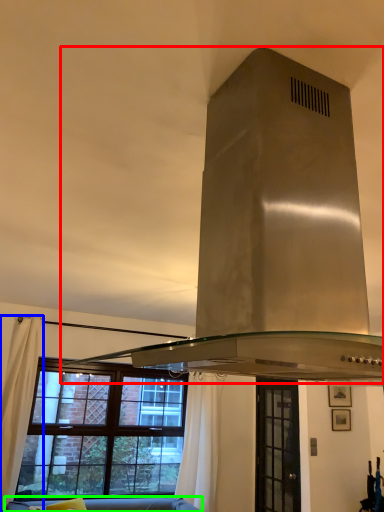
Question: Considering the real-world distances, which object is closest to exhaust hood (highlighted by a red box)? curtain (highlighted by a blue box) or studio couch (highlighted by a green box).

Choices:
 (A) curtain
 (B) studio couch

Answer: (A)